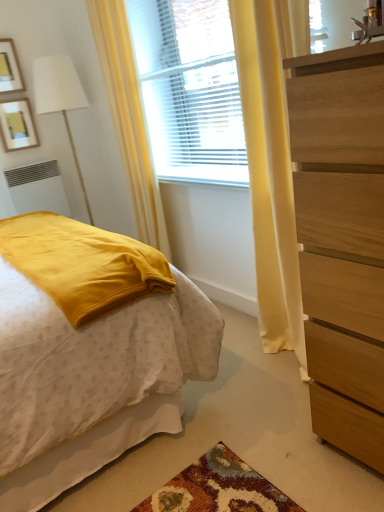
Question: Considering the relative positions of yellow fabric curtain at left and white matte radiator at lower left in the image provided, is yellow fabric curtain at left to the left or to the right of white matte radiator at lower left?

Choices:
 (A) right
 (B) left

Answer: (A)

Question: Relative to white matte radiator at lower left, is yellow fabric curtain at left in front or behind?

Choices:
 (A) behind
 (B) front

Answer: (B)

Question: Which object is positioned farthest from the white matte radiator at lower left?

Choices:
 (A) wooden picture frame at upper left, marked as the second picture frame in a top-to-bottom arrangement
 (B) matte yellow blanket at left
 (C) yellow fabric curtain at left
 (D) translucent wood window at center
 (E) wooden dresser at right

Answer: (E)

Question: Estimate the real-world distances between objects in this image. Which object is farther from the wooden picture frame at upper left, placed as the first picture frame when sorted from bottom to top?

Choices:
 (A) wooden picture frame at upper left, which is counted as the 1th picture frame, starting from the top
 (B) translucent wood window at center
 (C) matte yellow blanket at left
 (D) yellow fabric curtain at left
 (E) wooden dresser at right

Answer: (E)